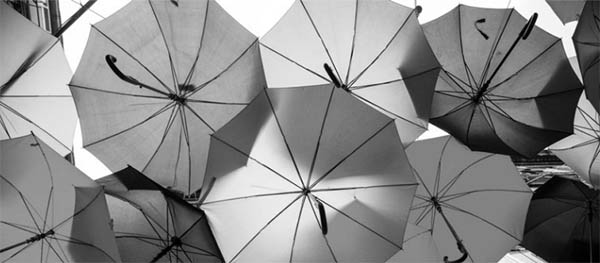
Where is `hook`? This screenshot has width=600, height=263. hook is located at coordinates (118, 72).